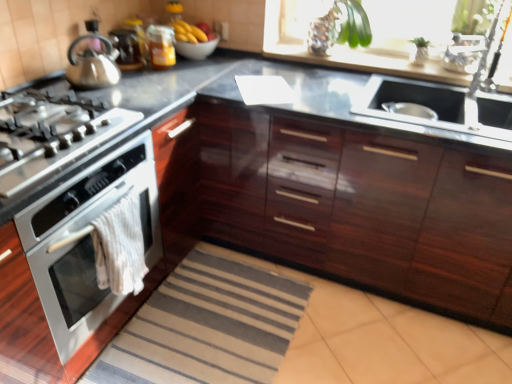
Find the location of a particular element. free spot to the right of shiny metallic kettle at upper left is located at coordinates (146, 84).